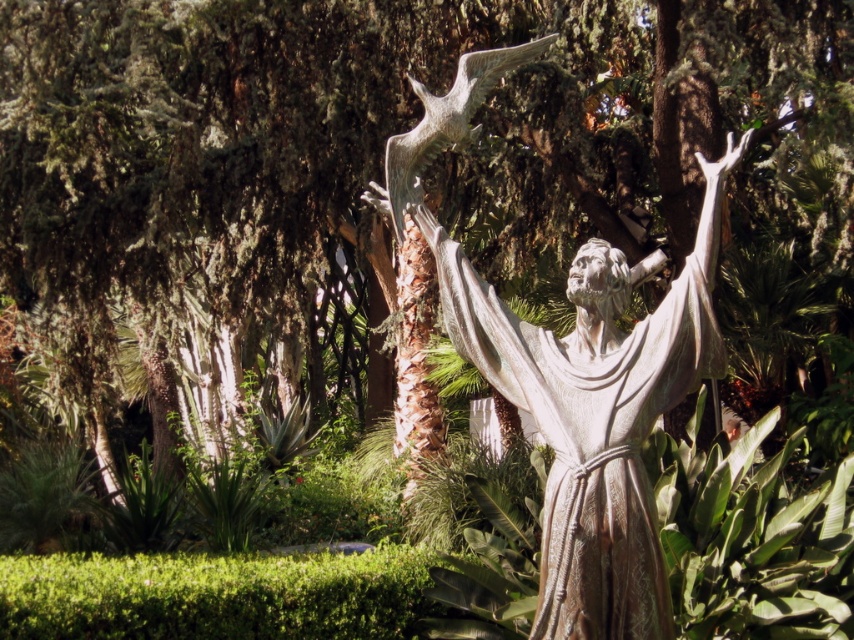
Question: Which point is closer to the camera?

Choices:
 (A) (661, 349)
 (B) (390, 202)

Answer: (A)

Question: Does bronze statue at center have a lesser width compared to shiny silver bird at upper center?

Choices:
 (A) yes
 (B) no

Answer: (B)

Question: Can you confirm if bronze statue at center is thinner than shiny silver bird at upper center?

Choices:
 (A) no
 (B) yes

Answer: (A)

Question: Can you confirm if bronze statue at center is positioned below shiny silver bird at upper center?

Choices:
 (A) yes
 (B) no

Answer: (A)